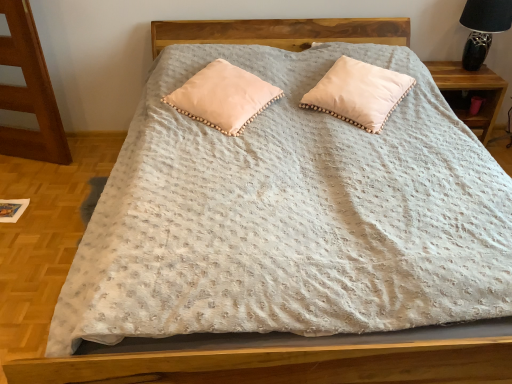
Locate an element on the screen. free space on the front side of black ceramic table lamp at upper right is located at coordinates (478, 81).